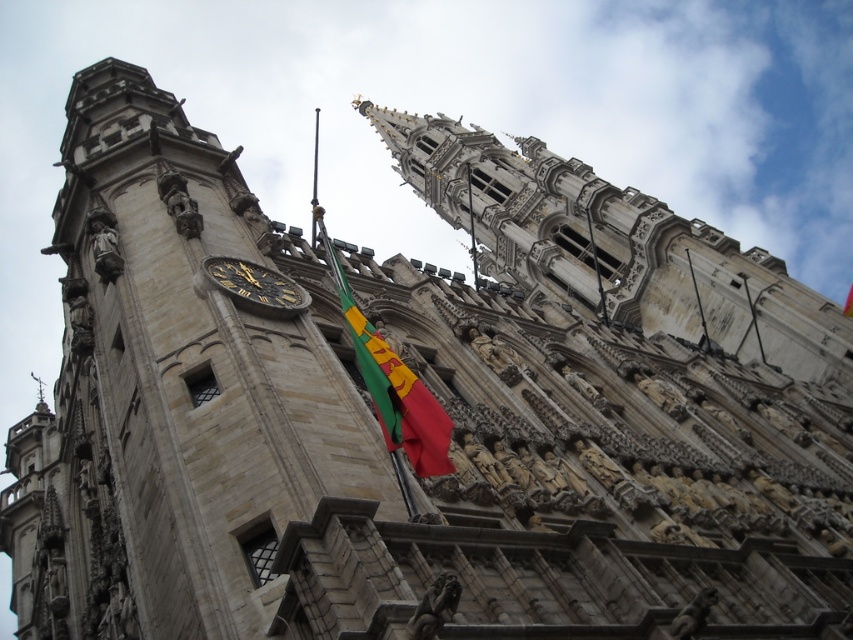
Who is more distant from viewer, (x=444, y=436) or (x=206, y=262)?

Positioned behind is point (x=206, y=262).

Between point (389, 353) and point (231, 273), which one is positioned in front?

Point (389, 353) is more forward.

This screenshot has width=853, height=640. I want to click on green fabric flag at center, so click(x=395, y=388).